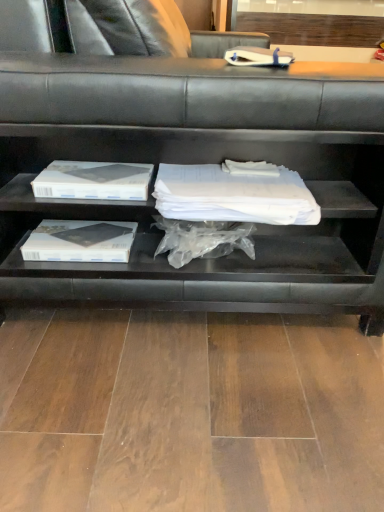
Image resolution: width=384 pixels, height=512 pixels. I want to click on free space in front of white paper at upper center, so click(x=273, y=90).